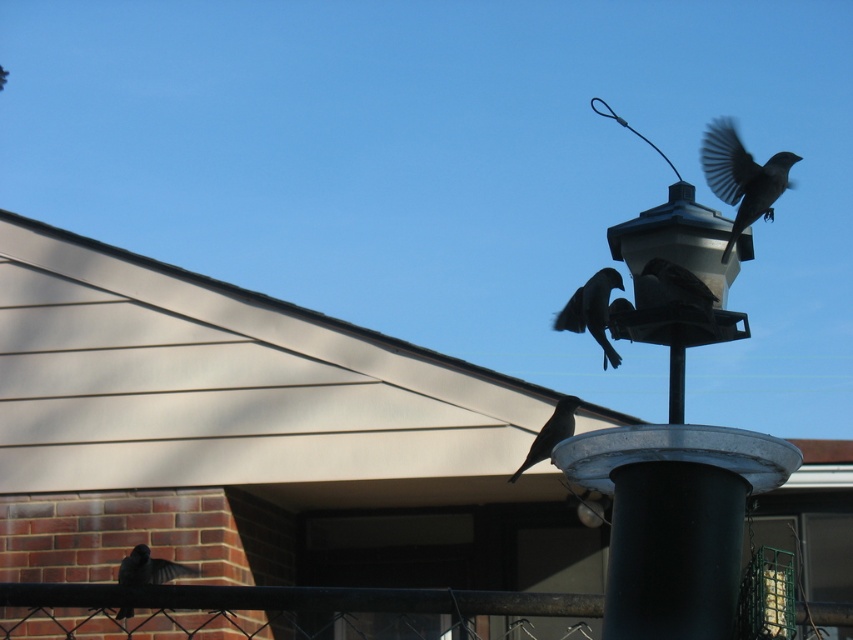
Does dark gray feathers at upper right appear over shiny black bird at center?

Correct, dark gray feathers at upper right is located above shiny black bird at center.

Which is more to the left, dark gray feathers at upper right or shiny black bird at center?

shiny black bird at center

Locate an element on the screen. This screenshot has height=640, width=853. dark gray feathers at upper right is located at coordinates (741, 177).

Where is `dark gray feathers at upper right`? dark gray feathers at upper right is located at coordinates (741, 177).

Does point (540, 445) come farther from viewer compared to point (682, 385)?

That is True.

Is shiny black bird at center shorter than black matte pole at center?

Yes, shiny black bird at center is shorter than black matte pole at center.

Locate an element on the screen. This screenshot has height=640, width=853. shiny black bird at center is located at coordinates (550, 433).

Between silhouette matte bird at center and dark gray feathers at lower left, which one has less height?

Standing shorter between the two is dark gray feathers at lower left.

Consider the image. Does silhouette matte bird at center come in front of dark gray feathers at lower left?

Yes, it is.

Is point (602, 282) closer to camera compared to point (128, 563)?

Yes, point (602, 282) is in front of point (128, 563).

Locate an element on the screen. This screenshot has height=640, width=853. silhouette matte bird at center is located at coordinates (592, 310).